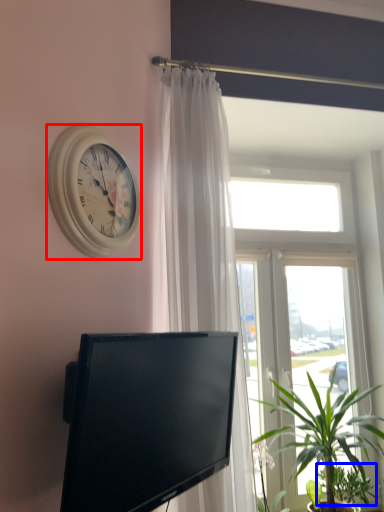
Question: Among these objects, which one is farthest to the camera, wall clock (highlighted by a red box) or plant (highlighted by a blue box)?

Choices:
 (A) wall clock
 (B) plant

Answer: (B)